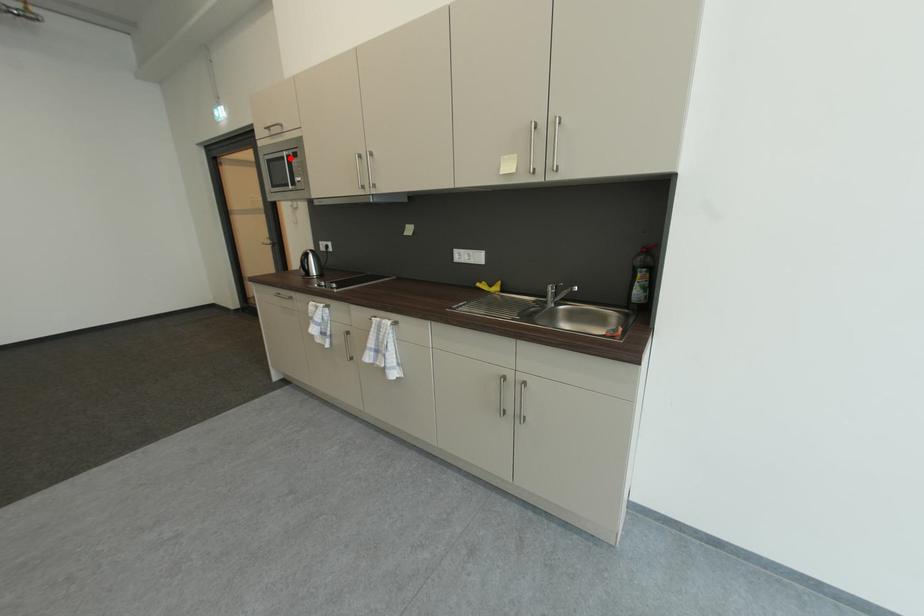
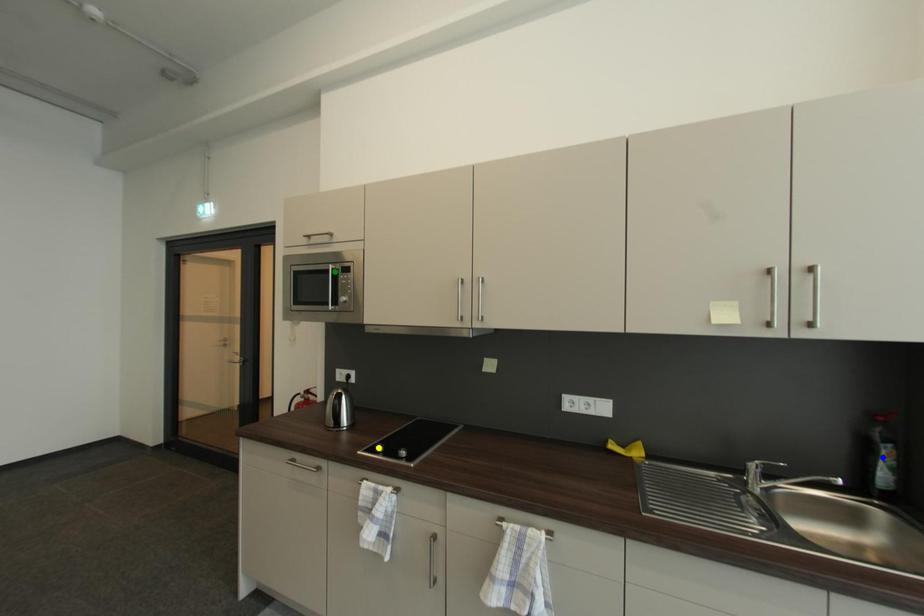
Question: I am providing you with two images of the same scene from different viewpoints. A red point is marked on the first image. You are given multiple points on the second image. Which point in image 2 is actually the same real-world point as the red point in image 1?

Choices:
 (A) green point
 (B) blue point
 (C) yellow point

Answer: (A)